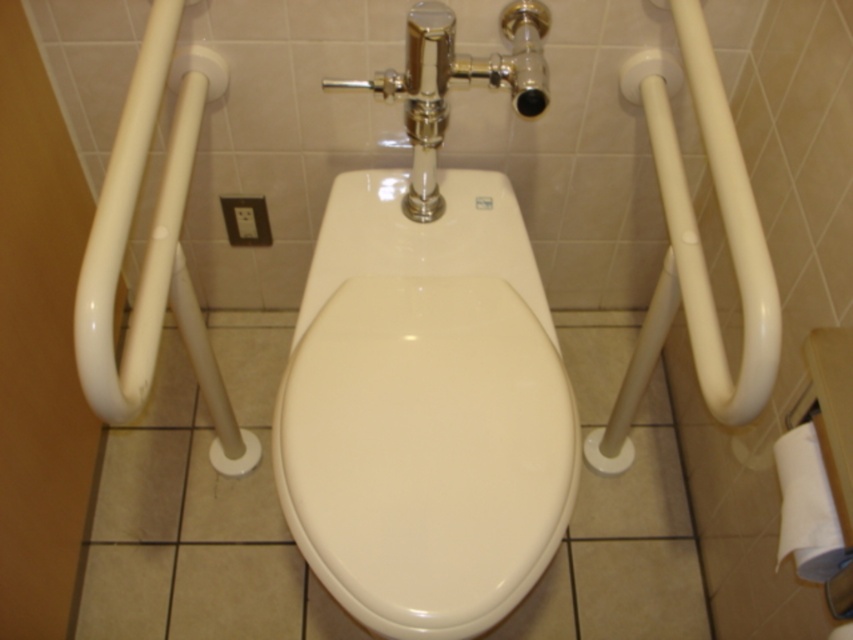
Is white glossy grab bar at upper left closer to camera compared to white glossy grab bar at right?

That is False.

Locate an element on the screen. The image size is (853, 640). white glossy grab bar at upper left is located at coordinates click(x=129, y=227).

Is point (160, 316) positioned before point (733, 240)?

No, (160, 316) is behind (733, 240).

Where is `white glossy grab bar at upper left`? white glossy grab bar at upper left is located at coordinates (129, 227).

Between white glossy grab bar at right and white paper towel at lower right, which one is positioned lower?

white paper towel at lower right is lower down.

From the picture: Who is more distant from viewer, (698, 257) or (793, 508)?

The point (698, 257) is behind.

Image resolution: width=853 pixels, height=640 pixels. What are the coordinates of `white glossy grab bar at right` in the screenshot? It's located at (724, 228).

Does white glossy toilet at center have a lesser width compared to white glossy grab bar at upper left?

In fact, white glossy toilet at center might be wider than white glossy grab bar at upper left.

In the scene shown: Measure the distance between white glossy toilet at center and camera.

A distance of 33.10 inches exists between white glossy toilet at center and camera.

Locate an element on the screen. white glossy toilet at center is located at coordinates (425, 410).